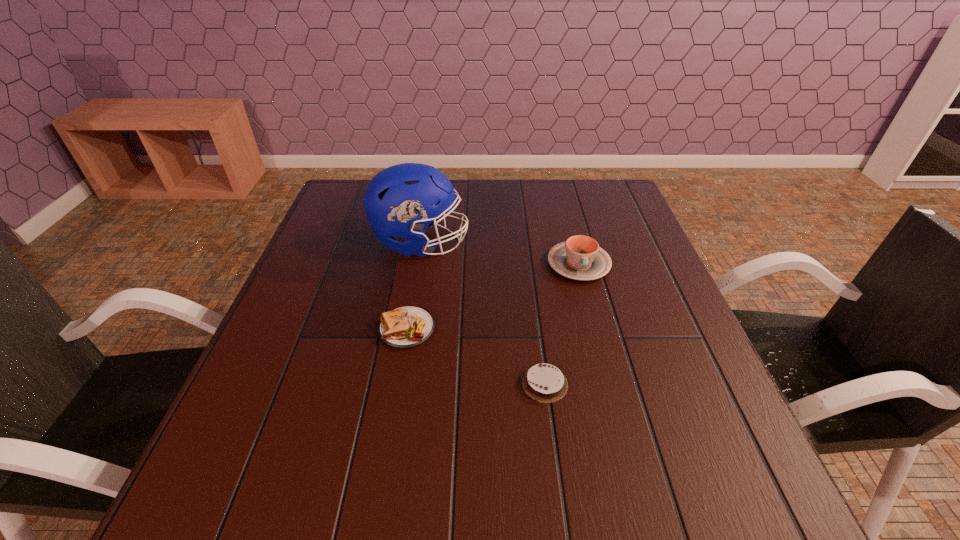
At what (x,y) coordinates should I click in order to perform the action: click on free spot located on the front of the shortest object. Please return your answer as a coordinate pair (x, y). The height and width of the screenshot is (540, 960). Looking at the image, I should click on (564, 524).

At what (x,y) coordinates should I click in order to perform the action: click on object that is at the left edge. Please return your answer as a coordinate pair (x, y). Looking at the image, I should click on (399, 201).

Locate an element on the screen. The width and height of the screenshot is (960, 540). object that is at the right edge is located at coordinates (580, 258).

In the image, there is a desktop. Identify the location of vacant space at the far edge. The height and width of the screenshot is (540, 960). (550, 193).

Where is `vacant space at the near edge`? This screenshot has height=540, width=960. vacant space at the near edge is located at coordinates (460, 484).

In the image, there is a desktop. Where is `free space at the left edge`? free space at the left edge is located at coordinates (253, 379).

I want to click on vacant space at the right edge of the desktop, so click(640, 254).

The image size is (960, 540). In order to click on free space at the far left corner of the desktop in this screenshot , I will do `click(347, 183)`.

Find the location of a particular element. The width and height of the screenshot is (960, 540). vacant area at the far right corner of the desktop is located at coordinates (579, 214).

This screenshot has height=540, width=960. I want to click on vacant space that is in between the football helmet and the rightmost object, so click(499, 253).